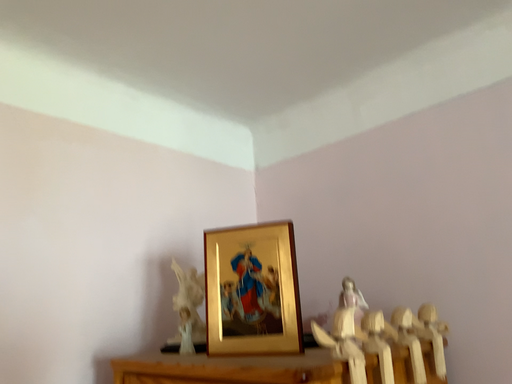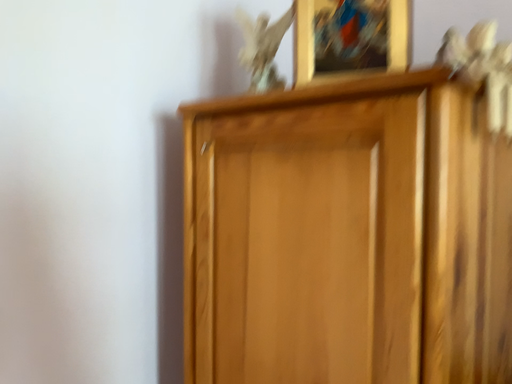
Question: How did the camera likely rotate when shooting the video?

Choices:
 (A) rotated upward
 (B) rotated downward

Answer: (B)